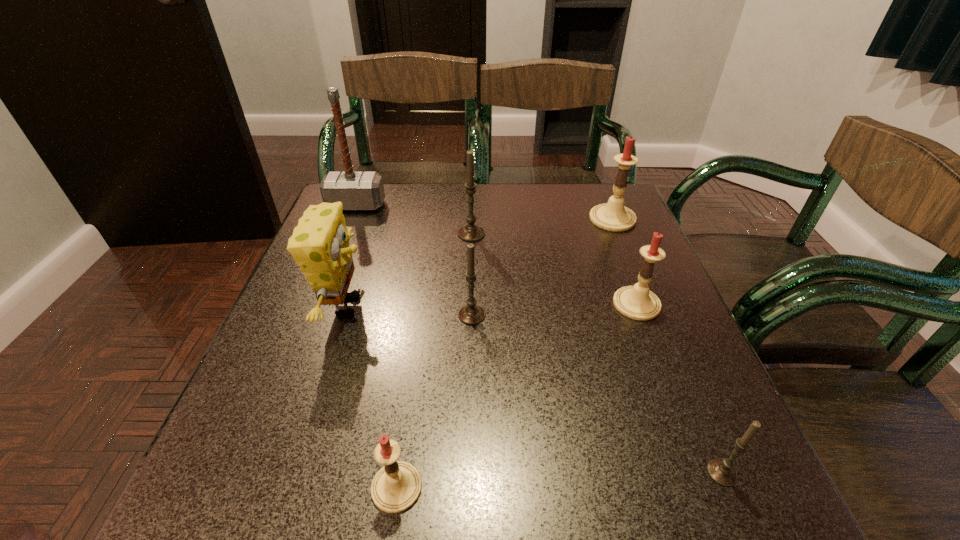
Locate an element on the screen. empty space that is in between the nearest red candle and the farthest red candle is located at coordinates (505, 353).

This screenshot has height=540, width=960. What are the coordinates of `object that is the second closest to the hammer` in the screenshot? It's located at (470, 232).

At what (x,y) coordinates should I click in order to perform the action: click on object that is the fifth closest one to the second smallest red candle. Please return your answer as a coordinate pair (x, y). The height and width of the screenshot is (540, 960). Looking at the image, I should click on (396, 487).

Choose which candle is the third nearest neighbor to the second farthest red candle. Please provide its 2D coordinates. Your answer should be formatted as a tuple, i.e. [(x, y)], where the tuple contains the x and y coordinates of a point satisfying the conditions above.

[(721, 471)]

Locate an element on the screen. The height and width of the screenshot is (540, 960). candle that is the fourth closest one to the sponge is located at coordinates (637, 302).

The image size is (960, 540). Find the location of `gray candle that stands as the second closest to the tallest object`. gray candle that stands as the second closest to the tallest object is located at coordinates (471, 314).

Locate an element on the screen. gray candle that is the closest to the second smallest gray candle is located at coordinates (470, 232).

Identify which red candle is located as the third nearest to the second biggest gray candle. Please provide its 2D coordinates. Your answer should be formatted as a tuple, i.e. [(x, y)], where the tuple contains the x and y coordinates of a point satisfying the conditions above.

[(613, 216)]

Choose which red candle is the second nearest neighbor to the second biggest red candle. Please provide its 2D coordinates. Your answer should be formatted as a tuple, i.e. [(x, y)], where the tuple contains the x and y coordinates of a point satisfying the conditions above.

[(396, 487)]

The width and height of the screenshot is (960, 540). I want to click on vacant space that satisfies the following two spatial constraints: 1. on the striking surface of the brown hammer; 2. on the right side of the rightmost gray candle, so click(x=251, y=472).